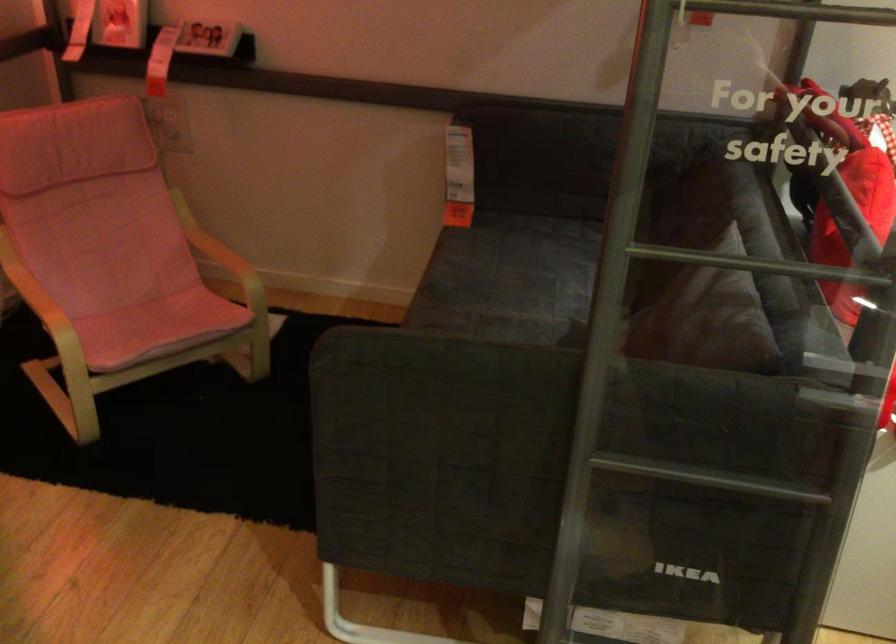
The image size is (896, 644). What do you see at coordinates (618, 114) in the screenshot?
I see `the grey sofa armrest` at bounding box center [618, 114].